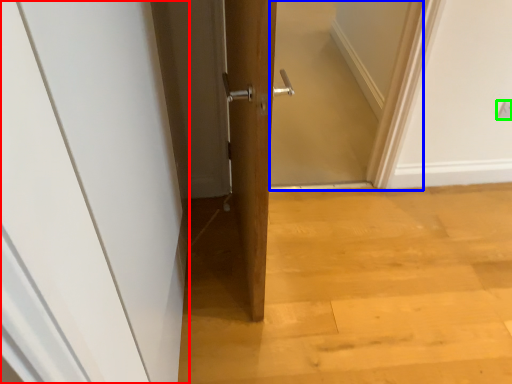
Question: Which object is the closest to the door (highlighted by a red box)? Choose among these: screen door (highlighted by a blue box) or electric outlet (highlighted by a green box).

Choices:
 (A) screen door
 (B) electric outlet

Answer: (A)